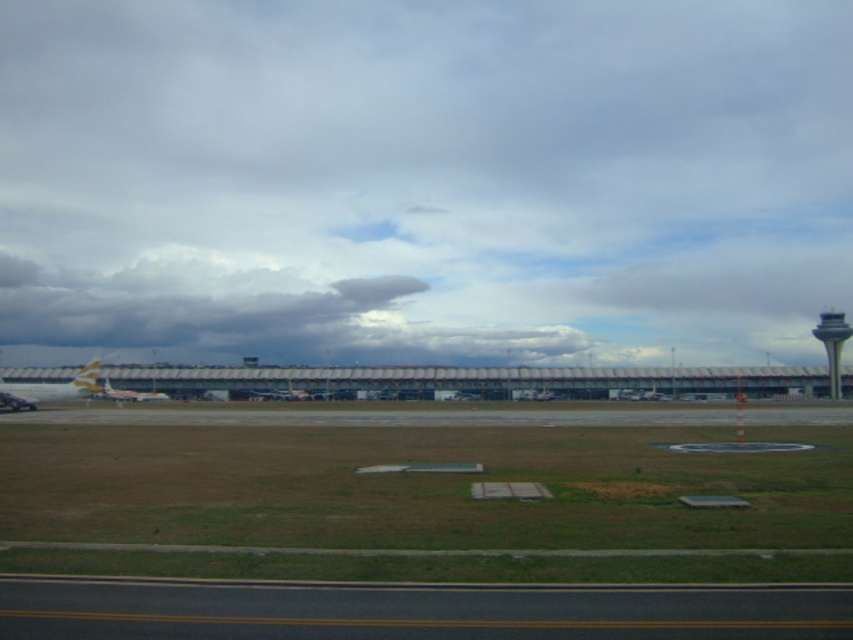
Question: Which of the following is the farthest from the observer?

Choices:
 (A) black asphalt runway at lower center
 (B) gray fluffy cloud at upper center
 (C) gray concrete control tower at right
 (D) white glossy airplane at center

Answer: (B)

Question: Which object is the farthest from the black asphalt runway at lower center?

Choices:
 (A) white glossy airplane at center
 (B) metallic silver airplane at center
 (C) gray fluffy cloud at upper center
 (D) gray concrete control tower at right

Answer: (C)

Question: Is black asphalt runway at lower center wider than gray concrete control tower at right?

Choices:
 (A) no
 (B) yes

Answer: (B)

Question: Is black asphalt runway at lower center positioned at the back of white glossy airplane at center?

Choices:
 (A) yes
 (B) no

Answer: (B)

Question: Can you confirm if gray concrete control tower at right is positioned below white glossy airplane at center?

Choices:
 (A) no
 (B) yes

Answer: (A)

Question: Which is farther from the black asphalt runway at lower center?

Choices:
 (A) metallic silver airplane at center
 (B) gray concrete control tower at right
 (C) gray fluffy cloud at upper center
 (D) white glossy airplane at center

Answer: (C)